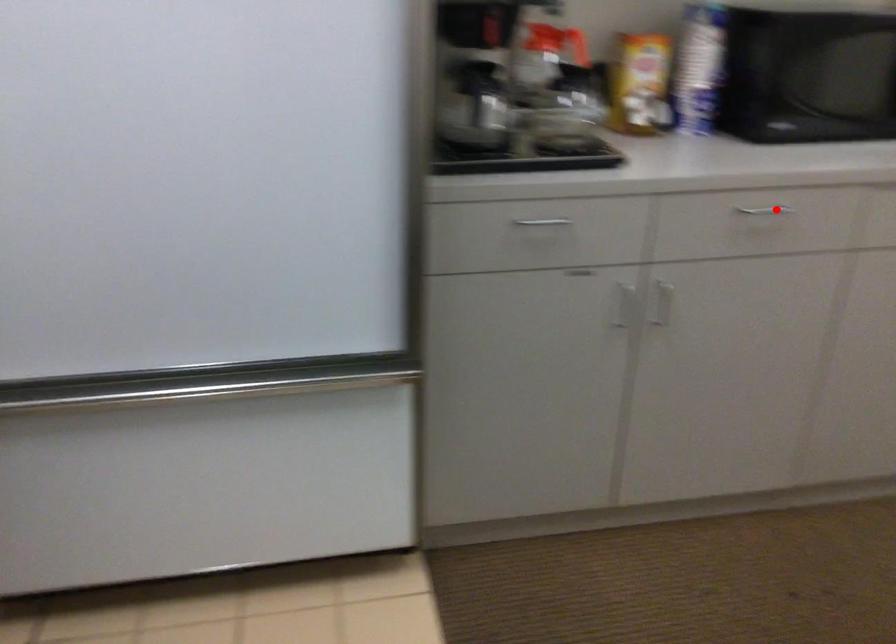
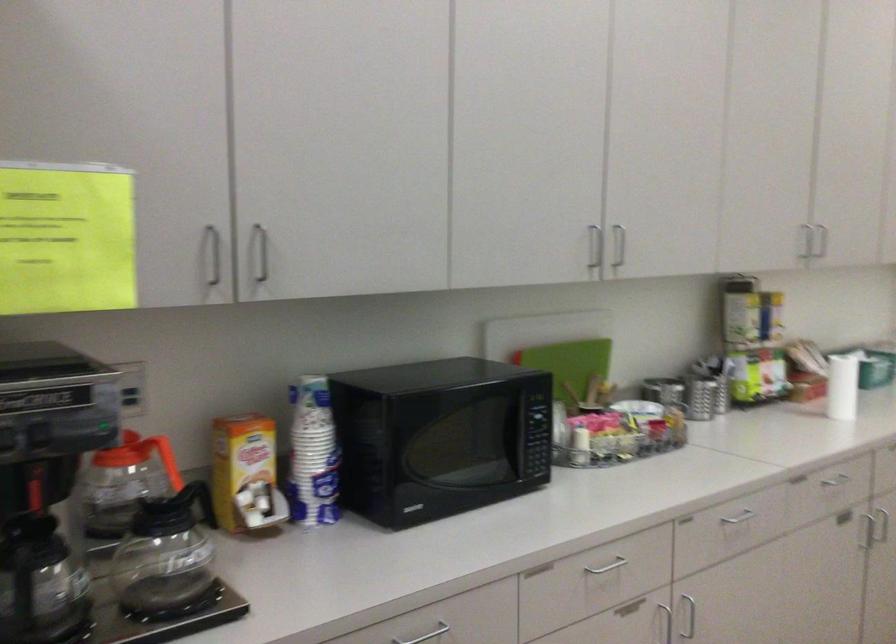
Question: I am providing you with two images of the same scene from different viewpoints. Given a red point in image1, look at the same physical point in image2. Is it:

Choices:
 (A) Closer to the viewpoint
 (B) Farther from the viewpoint

Answer: (A)